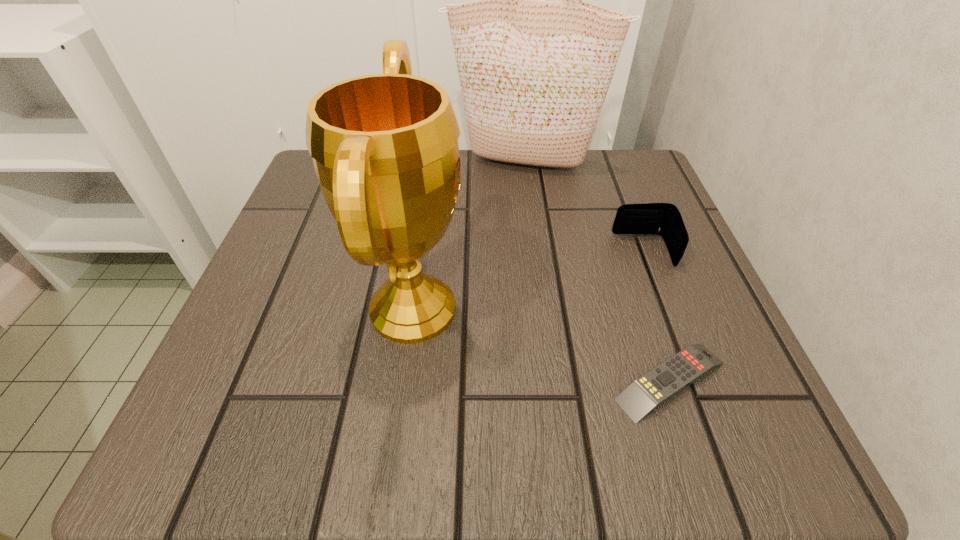
Locate an element on the screen. The height and width of the screenshot is (540, 960). blank space that satisfies the following two spatial constraints: 1. on the front-facing side of the remote control; 2. on the right side of the third shortest object is located at coordinates point(403,381).

Where is `vacant space that satisfies the following two spatial constraints: 1. on the front side of the remote control; 2. on the right side of the shopping bag`? Image resolution: width=960 pixels, height=540 pixels. vacant space that satisfies the following two spatial constraints: 1. on the front side of the remote control; 2. on the right side of the shopping bag is located at coordinates (551, 381).

The height and width of the screenshot is (540, 960). What are the coordinates of `blank area in the image that satisfies the following two spatial constraints: 1. on the back side of the shortest object; 2. on the front-facing side of the award` in the screenshot? It's located at (646, 309).